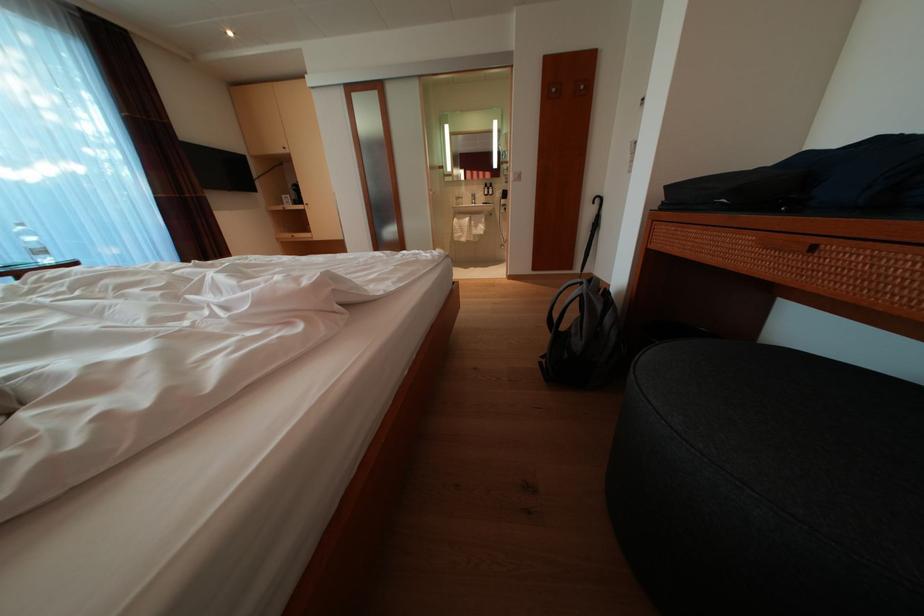
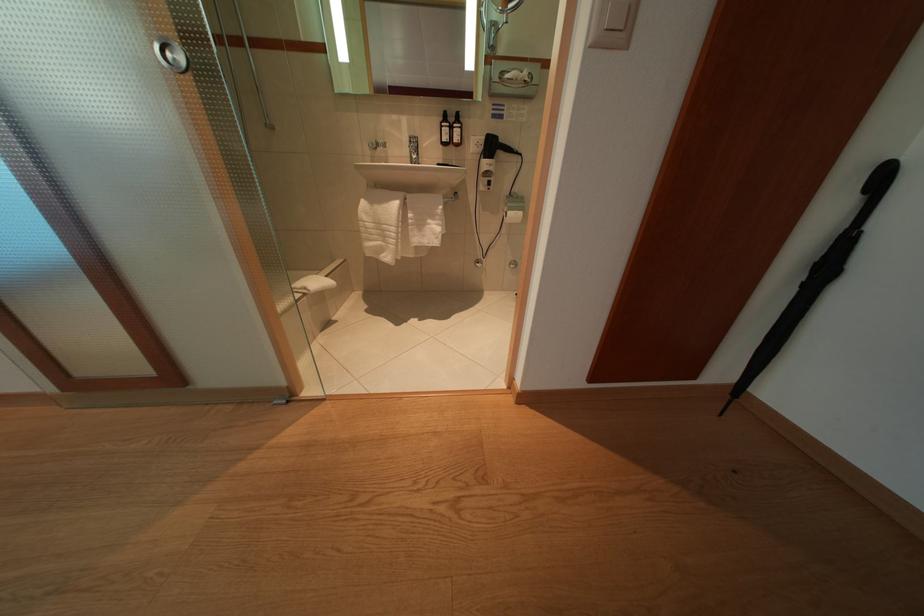
In the second image, find the point that corresponds to (499,191) in the first image.

(466, 124)